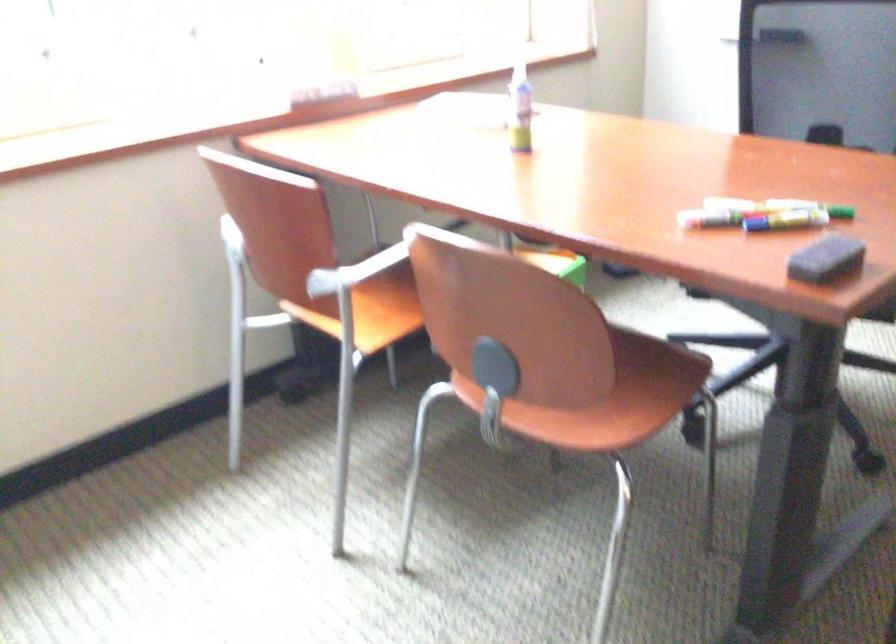
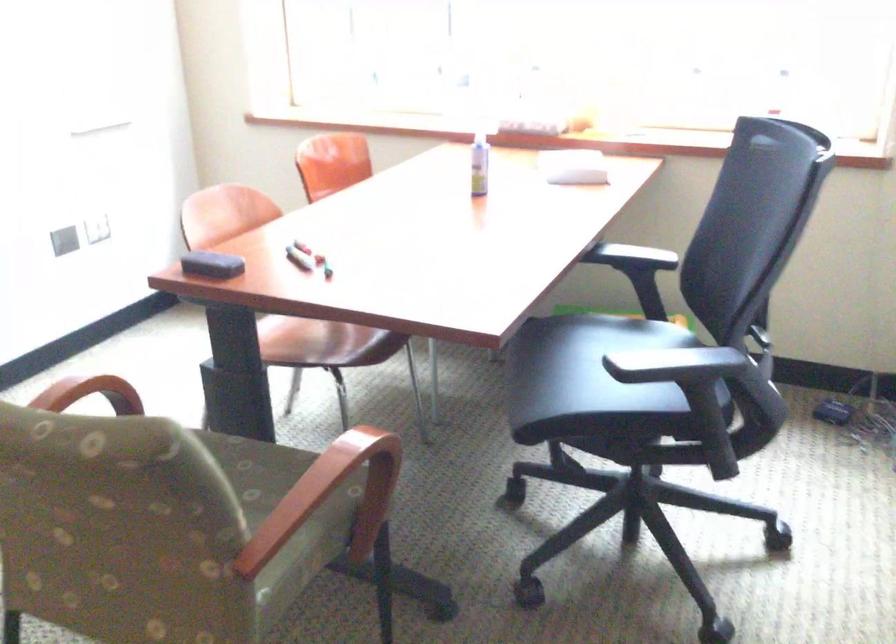
Locate, in the second image, the point that corresponds to point (813, 261) in the first image.

(211, 265)